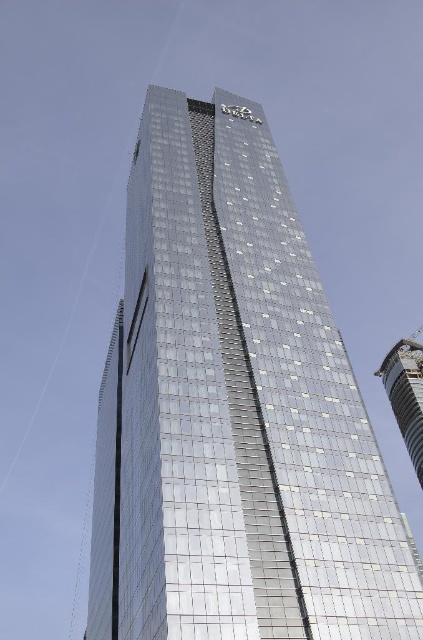
What do you see at coordinates (233, 412) in the screenshot? The height and width of the screenshot is (640, 423). I see `shiny glass tower at center` at bounding box center [233, 412].

In the scene shown: Does shiny glass tower at center lie in front of shiny metallic tower at right?

Yes, shiny glass tower at center is closer to the viewer.

Locate an element on the screen. This screenshot has height=640, width=423. shiny glass tower at center is located at coordinates (233, 412).

Locate an element on the screen. The image size is (423, 640). shiny glass tower at center is located at coordinates (233, 412).